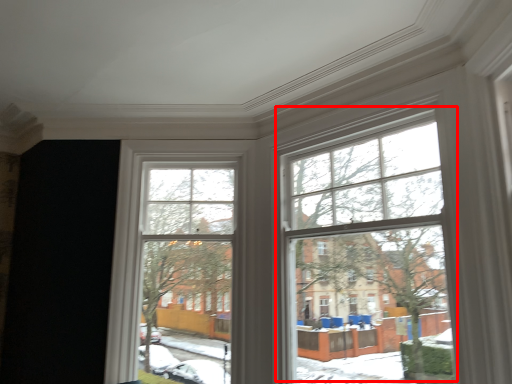
Question: From the image, what is the correct spatial relationship of bay window (annotated by the red box) in relation to bay window?

Choices:
 (A) left
 (B) right

Answer: (B)